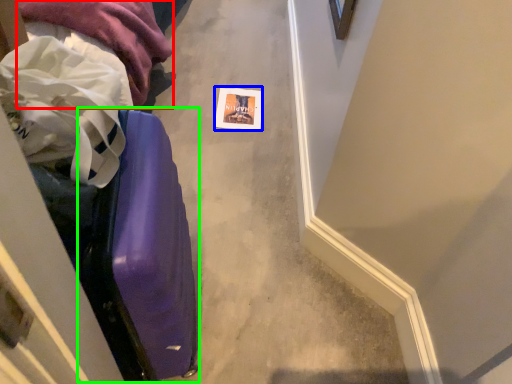
Question: Considering the real-world distances, which object is closest to clothing (highlighted by a red box)? postcard (highlighted by a blue box) or luggage (highlighted by a green box).

Choices:
 (A) postcard
 (B) luggage

Answer: (A)